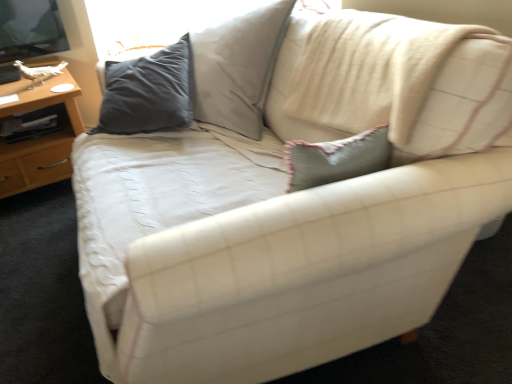
Question: Considering the positions of point (22, 150) and point (490, 61), is point (22, 150) closer or farther from the camera than point (490, 61)?

Choices:
 (A) closer
 (B) farther

Answer: (B)

Question: In terms of width, does wooden table at left look wider or thinner when compared to light blue textured pillow at upper right?

Choices:
 (A) wide
 (B) thin

Answer: (A)

Question: From a real-world perspective, is wooden table at left positioned above or below light blue textured pillow at upper right?

Choices:
 (A) above
 (B) below

Answer: (B)

Question: From the image's perspective, is light blue textured pillow at upper right positioned above or below wooden table at left?

Choices:
 (A) below
 (B) above

Answer: (B)

Question: Is light blue textured pillow at upper right situated inside wooden table at left or outside?

Choices:
 (A) outside
 (B) inside

Answer: (A)

Question: From their relative heights in the image, would you say light blue textured pillow at upper right is taller or shorter than wooden table at left?

Choices:
 (A) short
 (B) tall

Answer: (B)

Question: From a real-world perspective, relative to wooden table at left, is light blue textured pillow at upper right vertically above or below?

Choices:
 (A) below
 (B) above

Answer: (B)